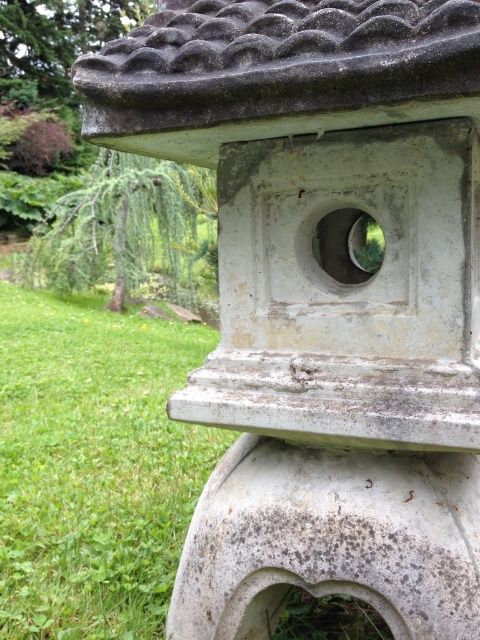
You are a photographer adjusting your camera settings to focus on the stone lantern in the garden. You notice two points on the lantern marked as point 1 at coordinates (58, 472) and point 2 at coordinates (349, 589). Which point should you focus on first to ensure proper depth of field?

Point 1 at coordinates (58, 472) is closer to the camera than point 2 at coordinates (349, 589). Therefore, you should focus on point 1 first to ensure proper depth of field.